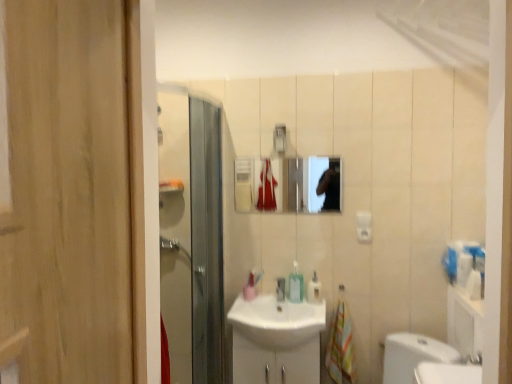
Question: From the image's perspective, is matte silver faucet at sink center located above translucent plastic soap dispenser at center, which appears as the second soap dispenser when viewed from the right?

Choices:
 (A) yes
 (B) no

Answer: (B)

Question: Would you consider matte silver faucet at sink center to be distant from translucent plastic soap dispenser at center, positioned as the 1th soap dispenser in left-to-right order?

Choices:
 (A) no
 (B) yes

Answer: (A)

Question: From a real-world perspective, does matte silver faucet at sink center stand above translucent plastic soap dispenser at center, which appears as the second soap dispenser when viewed from the right?

Choices:
 (A) yes
 (B) no

Answer: (B)

Question: Is translucent plastic soap dispenser at center, which appears as the second soap dispenser when viewed from the right, surrounded by matte silver faucet at sink center?

Choices:
 (A) no
 (B) yes

Answer: (A)

Question: Is matte silver faucet at sink center taller than translucent plastic soap dispenser at center, positioned as the 1th soap dispenser in left-to-right order?

Choices:
 (A) yes
 (B) no

Answer: (B)

Question: Does matte silver faucet at sink center appear on the right side of translucent plastic soap dispenser at center, positioned as the 1th soap dispenser in left-to-right order?

Choices:
 (A) yes
 (B) no

Answer: (B)

Question: Does multicolored fabric hand towel at lower right have a lesser width compared to matte silver faucet at sink center?

Choices:
 (A) no
 (B) yes

Answer: (B)

Question: Considering the relative sizes of multicolored fabric hand towel at lower right and matte silver faucet at sink center in the image provided, is multicolored fabric hand towel at lower right taller than matte silver faucet at sink center?

Choices:
 (A) no
 (B) yes

Answer: (B)

Question: Does multicolored fabric hand towel at lower right lie in front of matte silver faucet at sink center?

Choices:
 (A) yes
 (B) no

Answer: (A)

Question: From a real-world perspective, is multicolored fabric hand towel at lower right over matte silver faucet at sink center?

Choices:
 (A) no
 (B) yes

Answer: (A)

Question: From the image's perspective, is multicolored fabric hand towel at lower right below matte silver faucet at sink center?

Choices:
 (A) yes
 (B) no

Answer: (A)

Question: Can you confirm if multicolored fabric hand towel at lower right is smaller than matte silver faucet at sink center?

Choices:
 (A) yes
 (B) no

Answer: (B)

Question: From the image's perspective, is translucent plastic soap dispenser at center, which appears as the second soap dispenser when viewed from the right, above translucent plastic soap dispenser at center, positioned as the 1th soap dispenser in right-to-left order?

Choices:
 (A) no
 (B) yes

Answer: (B)